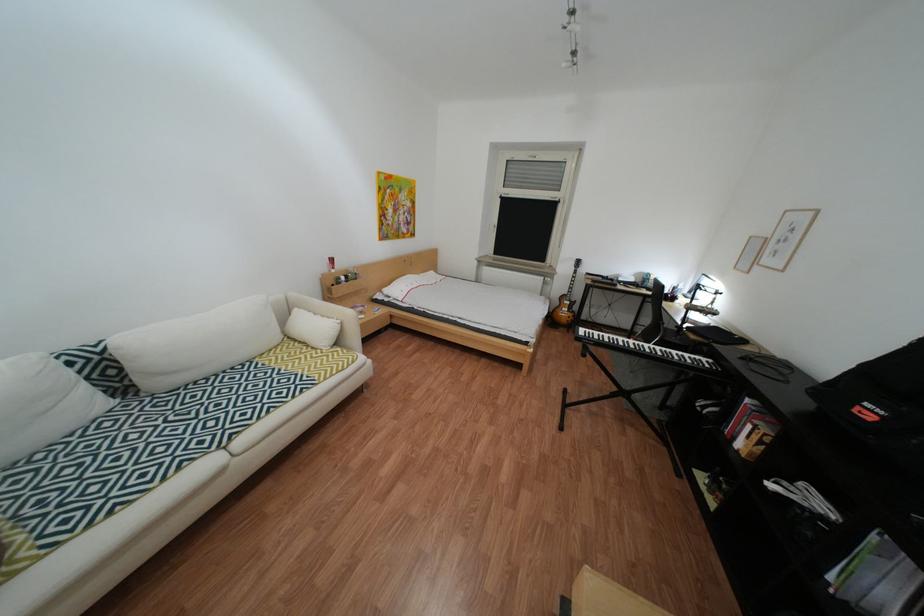
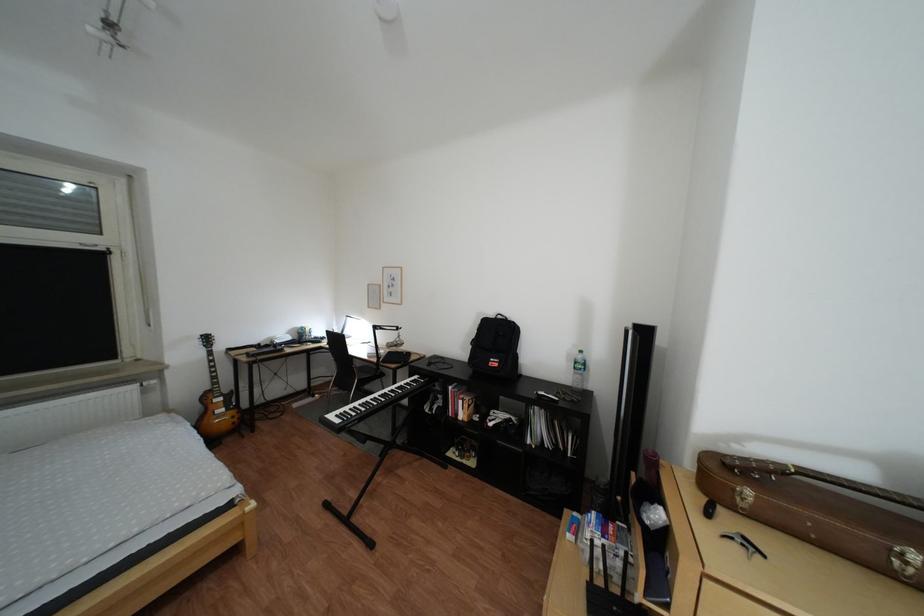
The point at (589,264) is marked in the first image. Where is the corresponding point in the second image?

(213, 344)